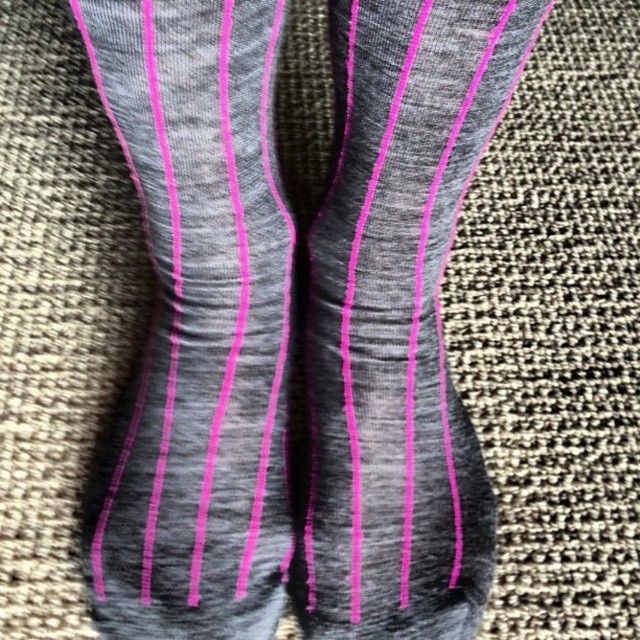
Does gray heathered sock at center have a lesser width compared to matte gray sock at center?

Indeed, gray heathered sock at center has a lesser width compared to matte gray sock at center.

Who is more forward, (220,256) or (342,246)?

Positioned in front is point (220,256).

Where is `gray heathered sock at center`? gray heathered sock at center is located at coordinates (196, 324).